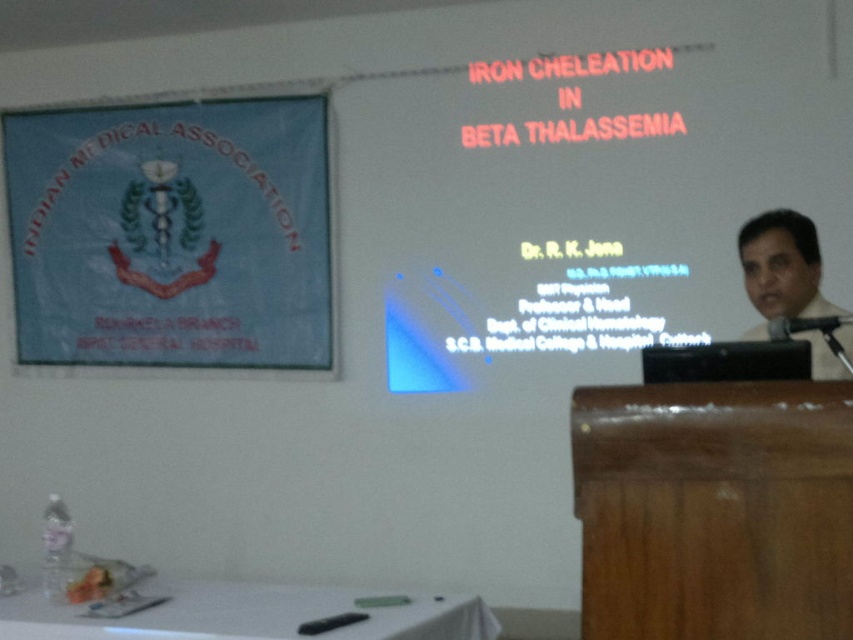
Question: Can you confirm if white plastic table at lower center is wider than dark gray shirt at right?

Choices:
 (A) no
 (B) yes

Answer: (B)

Question: Is blue fabric banner at upper left to the left of white plastic table at lower center from the viewer's perspective?

Choices:
 (A) no
 (B) yes

Answer: (B)

Question: Is blue fabric banner at upper left to the right of white plastic table at lower center from the viewer's perspective?

Choices:
 (A) yes
 (B) no

Answer: (B)

Question: Which point is farther to the camera?

Choices:
 (A) (54, 184)
 (B) (795, 243)
 (C) (177, 602)

Answer: (A)

Question: Estimate the real-world distances between objects in this image. Which object is farther from the blue fabric banner at upper left?

Choices:
 (A) white plastic table at lower center
 (B) dark gray shirt at right

Answer: (B)

Question: Which point is farther to the camera?

Choices:
 (A) blue fabric banner at upper left
 (B) white plastic table at lower center

Answer: (A)